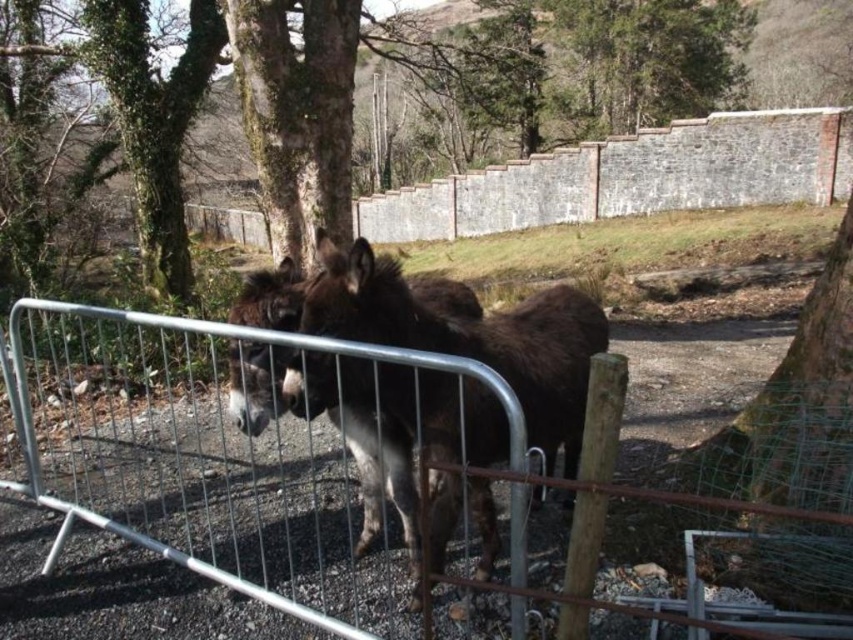
You are a photographer trying to capture a clear shot of the dark brown fur mule at center through the silver metallic fence at center. Based on the scene, can the fence obstruct the view of the mule?

The silver metallic fence at center is shorter than the dark brown fur mule at center, so the fence may not fully obstruct the view of the mule as the mule is taller than the fence.

You are a painter setting up an easel to paint the scene. You want to ensure the silver metallic fence at center and the brown rough bark tree at upper center are both visible in your painting. Given their sizes, which object should you place closer to the center of your canvas to maintain balance?

The silver metallic fence at center is wider than the brown rough bark tree at upper center, so to maintain balance in the painting, you should place the silver metallic fence at center closer to the center of the canvas since it is larger and will visually anchor the composition.

You are a photographer trying to capture a photo of the brown rough bark tree at upper center without the silver metallic fence at center blocking the view. Based on their positions, is this possible?

The silver metallic fence at center is to the left of the brown rough bark tree at upper center, so moving the camera to the right side of the fence might allow you to capture the tree without the fence blocking the view.